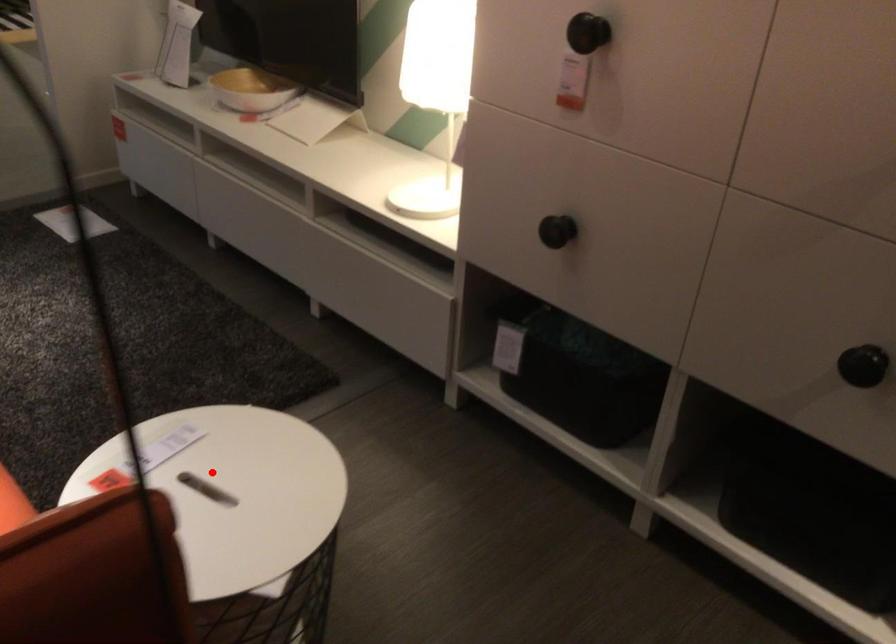
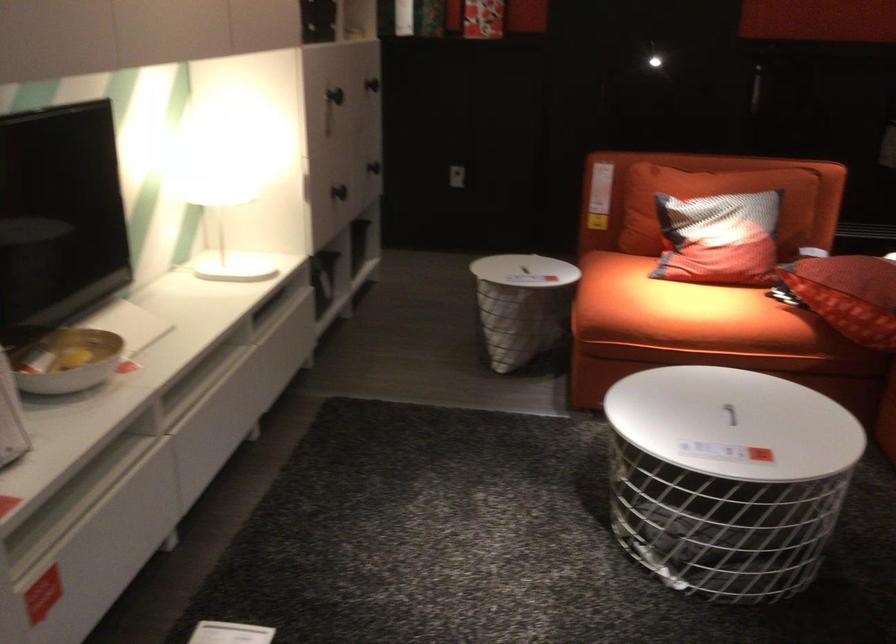
Question: A red point is marked in image1. In image2, is the corresponding 3D point closer to the camera or farther? Reply with the corresponding letter.

Choices:
 (A) The corresponding 3D point is closer.
 (B) The corresponding 3D point is farther.

Answer: (B)